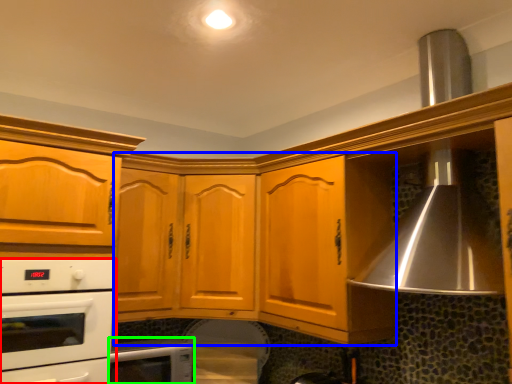
Question: Which is nearer to the home appliance (highlighted by a red box)? cabinetry (highlighted by a blue box) or home appliance (highlighted by a green box).

Choices:
 (A) cabinetry
 (B) home appliance

Answer: (B)